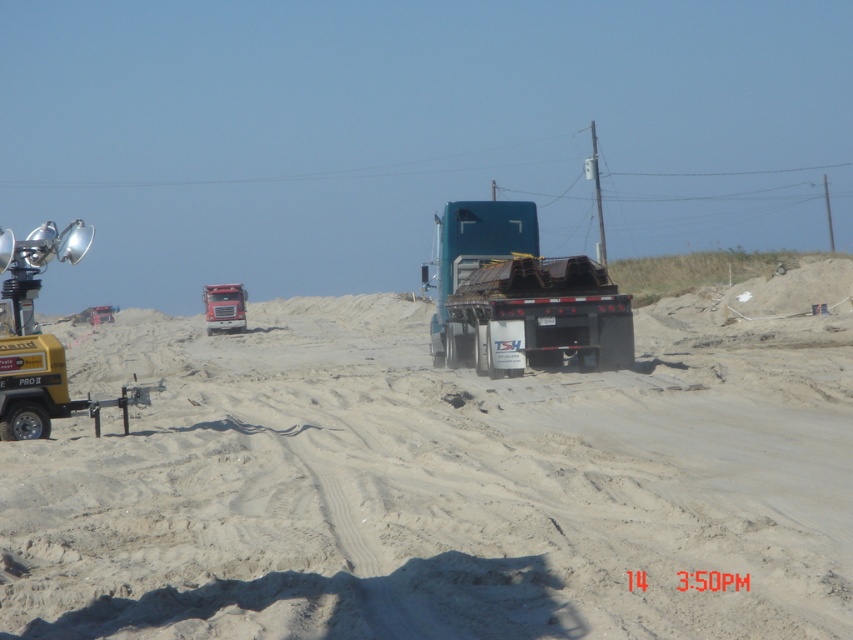
Who is positioned more to the left, sandy dirt field at center or teal matte trailer truck at center?

sandy dirt field at center is more to the left.

Is sandy dirt field at center below teal matte trailer truck at center?

Yes.

Who is more forward, (721, 563) or (535, 316)?

Point (721, 563)

Where is `sandy dirt field at center`? The width and height of the screenshot is (853, 640). sandy dirt field at center is located at coordinates (442, 481).

Can you confirm if yellow metallic light at left is bigger than matte red truck at center?

Yes, yellow metallic light at left is bigger than matte red truck at center.

Can you confirm if yellow metallic light at left is shorter than matte red truck at center?

No, yellow metallic light at left is not shorter than matte red truck at center.

Find the location of a particular element. yellow metallic light at left is located at coordinates (38, 337).

Is teal matte trailer truck at center closer to camera compared to yellow metallic light at left?

No, teal matte trailer truck at center is further to the viewer.

Is point (589, 260) positioned in front of point (42, 380)?

That is False.

I want to click on teal matte trailer truck at center, so click(520, 296).